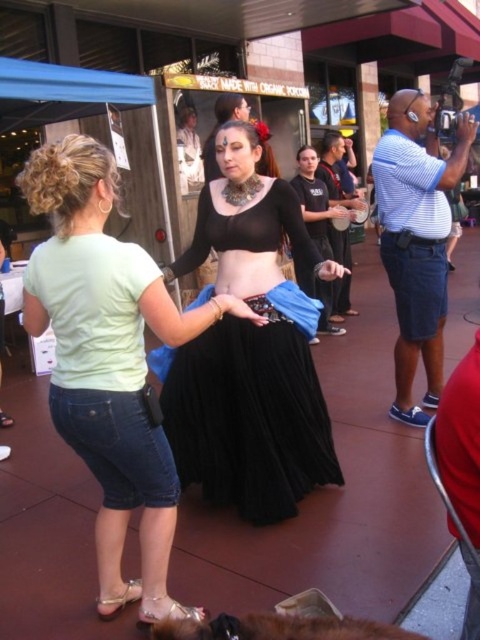
You are an event photographer at the festival. You need to capture a photo that highlights the height difference between the black satin skirt at center and the black pleated skirt at center. Which skirt should you focus on to show the taller one?

The black satin skirt at center has a greater height compared to the black pleated skirt at center, so you should focus on the black satin skirt at center to show the taller one.